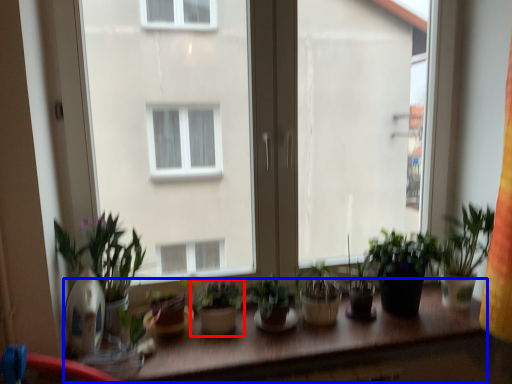
Question: Which object is further to the camera taking this photo, houseplant (highlighted by a red box) or table (highlighted by a blue box)?

Choices:
 (A) houseplant
 (B) table

Answer: (A)